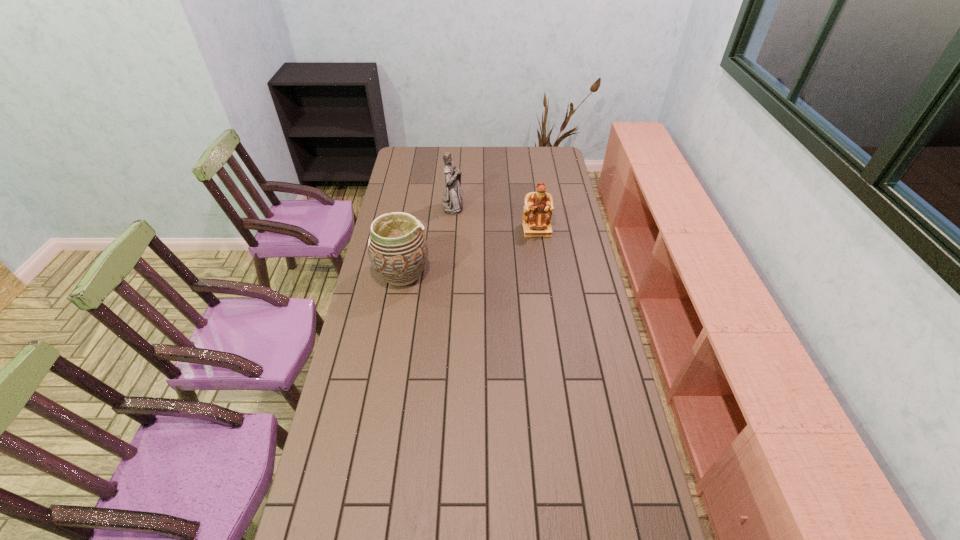
Identify the location of the left figurine. This screenshot has height=540, width=960. (452, 204).

At what (x,y) coordinates should I click in order to perform the action: click on the farther figurine. Please return your answer as a coordinate pair (x, y). Looking at the image, I should click on (452, 204).

In order to click on pottery in this screenshot , I will do `click(397, 247)`.

Locate an element on the screen. Image resolution: width=960 pixels, height=540 pixels. the nearest object is located at coordinates pyautogui.click(x=397, y=247).

This screenshot has width=960, height=540. I want to click on the nearer figurine, so [x=538, y=208].

Locate an element on the screen. the right figurine is located at coordinates (538, 208).

At what (x,y) coordinates should I click in order to perform the action: click on vacant space located on the front-facing side of the left figurine. Please return your answer as a coordinate pair (x, y). This screenshot has width=960, height=540. Looking at the image, I should click on (509, 206).

Identify the location of vacant region located on the right of the pottery. The width and height of the screenshot is (960, 540). (492, 273).

This screenshot has height=540, width=960. I want to click on vacant space located on the front-facing side of the shorter figurine, so click(542, 268).

This screenshot has width=960, height=540. In order to click on object that is at the left edge in this screenshot , I will do `click(397, 247)`.